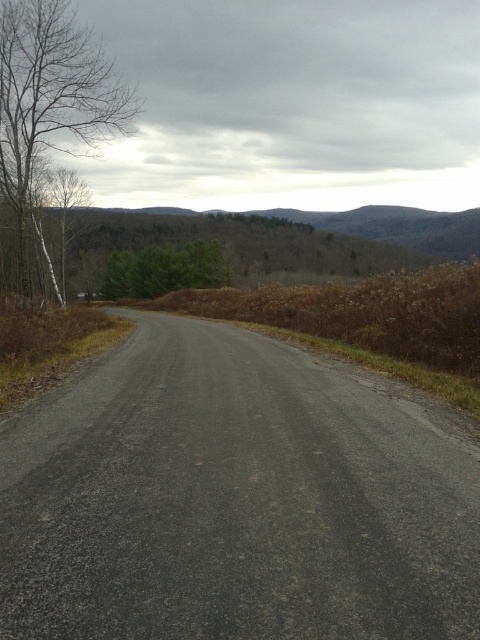
Which is more to the left, green forested mountain at upper center or green matte tree at center?

Positioned to the left is green forested mountain at upper center.

Who is taller, green forested mountain at upper center or green matte tree at center?

Standing taller between the two is green forested mountain at upper center.

Is point (278, 234) less distant than point (109, 278)?

No, (278, 234) is further to viewer.

The height and width of the screenshot is (640, 480). Find the location of `green forested mountain at upper center`. green forested mountain at upper center is located at coordinates (284, 237).

Consider the image. Which is more to the left, green forested mountain at upper center or bare wood tree at left?

bare wood tree at left is more to the left.

You are a GUI agent. You are given a task and a screenshot of the screen. Output one action in this format:
    pyautogui.click(x=<x>, y=<y>)
    Task: Click on the green forested mountain at upper center
    The height and width of the screenshot is (640, 480).
    Given the screenshot: What is the action you would take?
    (x=284, y=237)

Is bare wood tree at left further to the viewer compared to green matte tree at center?

That is False.

Between bare wood tree at left and green matte tree at center, which one is positioned higher?

Positioned higher is bare wood tree at left.

Which is behind, point (120, 109) or point (105, 284)?

The point (105, 284) is behind.

Find the location of a particular element. The width and height of the screenshot is (480, 640). bare wood tree at left is located at coordinates (49, 97).